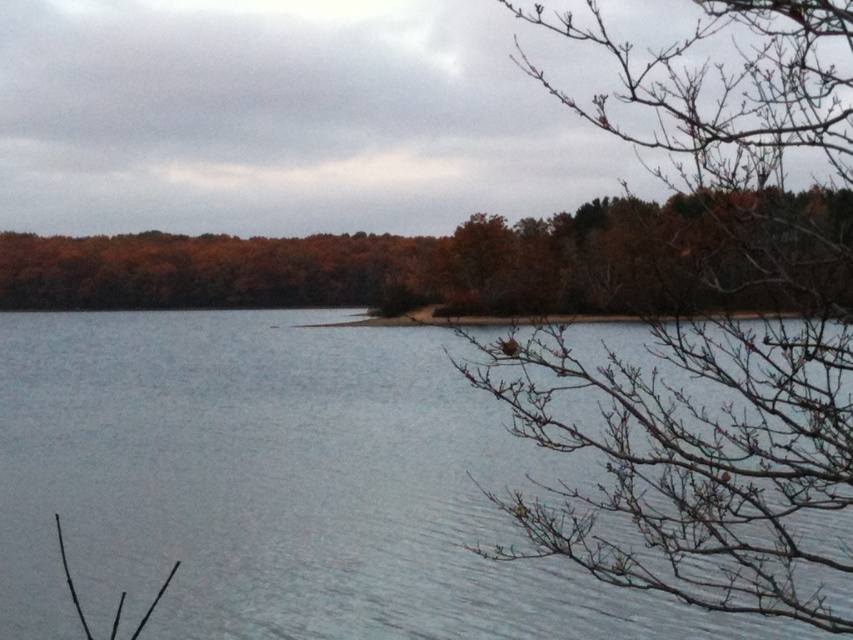
Looking at this image, can you confirm if bare branches at upper right is bigger than brown matte tree at center?

No, bare branches at upper right is not bigger than brown matte tree at center.

The image size is (853, 640). I want to click on bare branches at upper right, so click(717, 340).

Based on the photo, is clear water at center further to camera compared to brown matte tree at center?

Yes, it is behind brown matte tree at center.

Between clear water at center and brown matte tree at center, which one appears on the left side from the viewer's perspective?

clear water at center is more to the left.

The image size is (853, 640). What do you see at coordinates (281, 486) in the screenshot? I see `clear water at center` at bounding box center [281, 486].

You are a GUI agent. You are given a task and a screenshot of the screen. Output one action in this format:
    pyautogui.click(x=<x>, y=<y>)
    Task: Click on the clear water at center
    
    Given the screenshot: What is the action you would take?
    pyautogui.click(x=281, y=486)

Consider the image. Between clear water at center and bare branches at upper right, which one is positioned lower?

clear water at center

Is clear water at center smaller than bare branches at upper right?

Yes.

Image resolution: width=853 pixels, height=640 pixels. Identify the location of clear water at center. (281, 486).